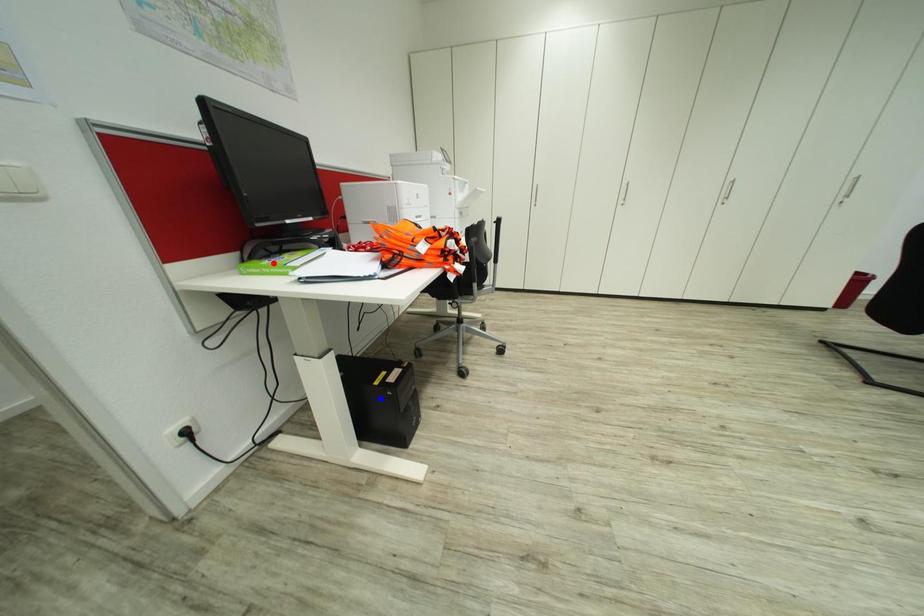
Question: Which of the two points in the image is closer to the camera?

Choices:
 (A) Blue point is closer.
 (B) Red point is closer.

Answer: (B)